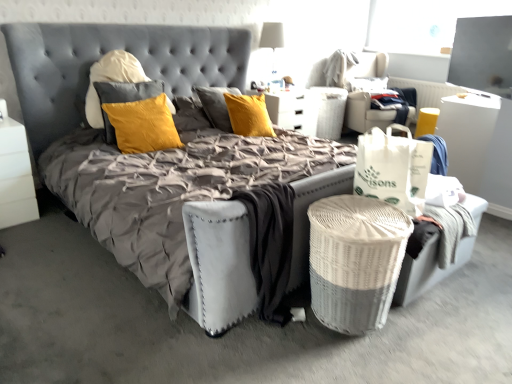
Question: Does yellow fabric swivel chair at upper right, the first swivel chair when ordered from right to left, have a larger size compared to white paper bag at right?

Choices:
 (A) yes
 (B) no

Answer: (A)

Question: Does yellow fabric swivel chair at upper right, the 2th swivel chair viewed from the left, have a greater width compared to white paper bag at right?

Choices:
 (A) yes
 (B) no

Answer: (A)

Question: Is yellow fabric swivel chair at upper right, the 2th swivel chair viewed from the left, with white paper bag at right?

Choices:
 (A) yes
 (B) no

Answer: (B)

Question: From a real-world perspective, is yellow fabric swivel chair at upper right, the 2th swivel chair viewed from the left, positioned over white paper bag at right based on gravity?

Choices:
 (A) no
 (B) yes

Answer: (A)

Question: Is yellow fabric swivel chair at upper right, the 2th swivel chair viewed from the left, turned away from white paper bag at right?

Choices:
 (A) yes
 (B) no

Answer: (B)

Question: Based on their positions, is yellow fabric swivel chair at upper right, the 2th swivel chair viewed from the left, located to the left or right of white wicker basket at center?

Choices:
 (A) left
 (B) right

Answer: (B)

Question: In the image, is yellow fabric swivel chair at upper right, the 2th swivel chair viewed from the left, positioned in front of or behind white wicker basket at center?

Choices:
 (A) front
 (B) behind

Answer: (A)

Question: From the image's perspective, is yellow fabric swivel chair at upper right, the first swivel chair when ordered from right to left, positioned above or below white wicker basket at center?

Choices:
 (A) below
 (B) above

Answer: (B)

Question: Looking at the image, does yellow fabric swivel chair at upper right, the 2th swivel chair viewed from the left, seem bigger or smaller compared to white wicker basket at center?

Choices:
 (A) small
 (B) big

Answer: (A)

Question: Looking at their shapes, would you say white glossy nightstand at left is wider or thinner than white paper bag at right?

Choices:
 (A) thin
 (B) wide

Answer: (B)

Question: Is white glossy nightstand at left in front of or behind white paper bag at right in the image?

Choices:
 (A) behind
 (B) front

Answer: (A)

Question: Is white glossy nightstand at left to the left or to the right of white paper bag at right in the image?

Choices:
 (A) right
 (B) left

Answer: (B)

Question: From the image's perspective, relative to white paper bag at right, is white glossy nightstand at left above or below?

Choices:
 (A) below
 (B) above

Answer: (B)

Question: Is white fabric swivel chair at upper right, which appears as the 2th swivel chair when viewed from the right, in front of or behind white paper bag at right in the image?

Choices:
 (A) behind
 (B) front

Answer: (A)

Question: In terms of size, does white fabric swivel chair at upper right, marked as the 1th swivel chair in a left-to-right arrangement, appear bigger or smaller than white paper bag at right?

Choices:
 (A) big
 (B) small

Answer: (A)